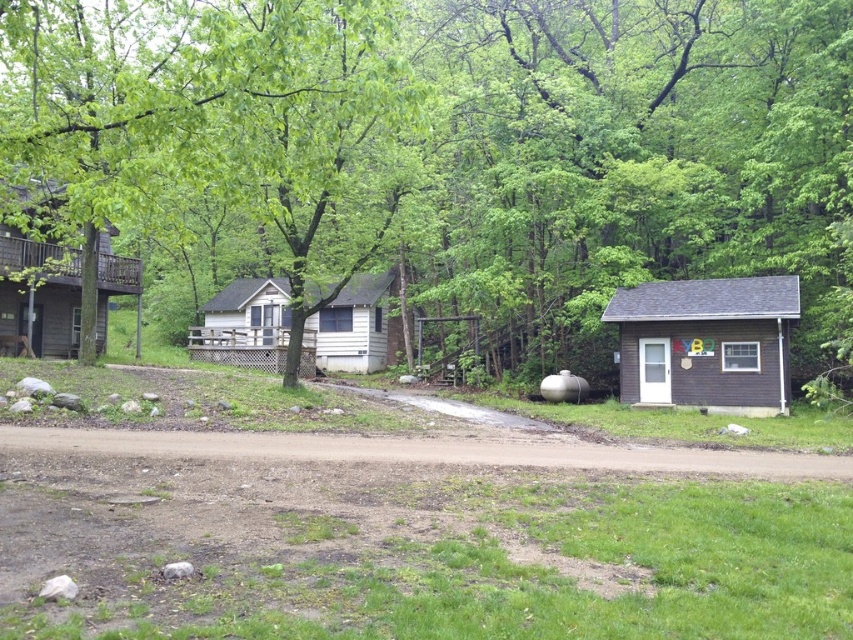
You are standing at the point marked by the coordinates point (x=457, y=141) in this rural scene. Looking around, what do you see directly in front of you?

You are standing at the point marked by the coordinates point (x=457, y=141) in this rural scene. Looking around, you see a green leafy tree at center directly in front of you.

You are standing at the end of the dirt path in the foreground and want to walk to the wooden cabin at left. Which direction should you head relative to the green leafy tree at center?

You should head to the left of the green leafy tree at center because the wooden cabin at left is positioned to the left of the green leafy tree at center.

You are standing at the point marked by the coordinates point (457,141) in the image. Looking around, what do you see directly in front of you?

You are standing at the point marked by the coordinates point (457,141), which marks green leafy tree at center. Directly in front of you is the green leafy tree at center.